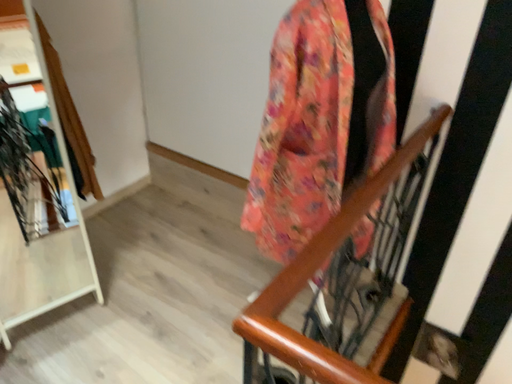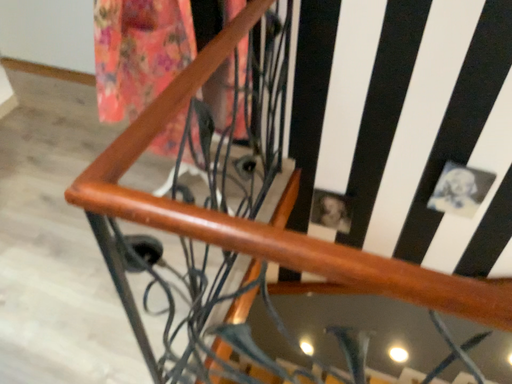
Question: Which way did the camera rotate in the video?

Choices:
 (A) rotated right
 (B) rotated left

Answer: (A)